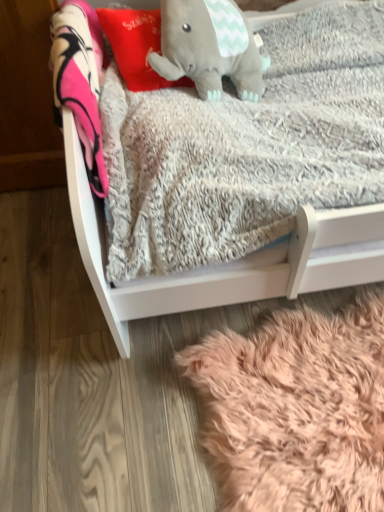
Question: Can you confirm if fuzzy pink rug at lower right is shorter than red plush pillow at upper center?

Choices:
 (A) no
 (B) yes

Answer: (B)

Question: Is fuzzy pink rug at lower right facing away from red plush pillow at upper center?

Choices:
 (A) yes
 (B) no

Answer: (B)

Question: Is fuzzy pink rug at lower right behind red plush pillow at upper center?

Choices:
 (A) yes
 (B) no

Answer: (B)

Question: From a real-world perspective, does fuzzy pink rug at lower right stand above red plush pillow at upper center?

Choices:
 (A) yes
 (B) no

Answer: (B)

Question: Is fuzzy pink rug at lower right in contact with red plush pillow at upper center?

Choices:
 (A) yes
 (B) no

Answer: (B)

Question: Considering the relative positions of fuzzy pink rug at lower right and gray plush elephant at upper center in the image provided, is fuzzy pink rug at lower right to the left or to the right of gray plush elephant at upper center?

Choices:
 (A) left
 (B) right

Answer: (B)

Question: From their relative heights in the image, would you say fuzzy pink rug at lower right is taller or shorter than gray plush elephant at upper center?

Choices:
 (A) tall
 (B) short

Answer: (B)

Question: From a real-world perspective, relative to gray plush elephant at upper center, is fuzzy pink rug at lower right vertically above or below?

Choices:
 (A) below
 (B) above

Answer: (A)

Question: Considering the positions of fuzzy pink rug at lower right and gray plush elephant at upper center in the image, is fuzzy pink rug at lower right bigger or smaller than gray plush elephant at upper center?

Choices:
 (A) big
 (B) small

Answer: (A)

Question: Is gray plush elephant at upper center to the left or to the right of white soft wood infant bed at center in the image?

Choices:
 (A) left
 (B) right

Answer: (A)

Question: Based on their sizes in the image, would you say gray plush elephant at upper center is bigger or smaller than white soft wood infant bed at center?

Choices:
 (A) small
 (B) big

Answer: (A)

Question: Is gray plush elephant at upper center in front of or behind white soft wood infant bed at center in the image?

Choices:
 (A) behind
 (B) front

Answer: (A)

Question: Does point (231, 34) appear closer or farther from the camera than point (124, 287)?

Choices:
 (A) farther
 (B) closer

Answer: (A)

Question: Is gray plush elephant at upper center inside or outside of fuzzy pink rug at lower right?

Choices:
 (A) inside
 (B) outside

Answer: (B)

Question: Relative to fuzzy pink rug at lower right, is gray plush elephant at upper center in front or behind?

Choices:
 (A) behind
 (B) front

Answer: (A)